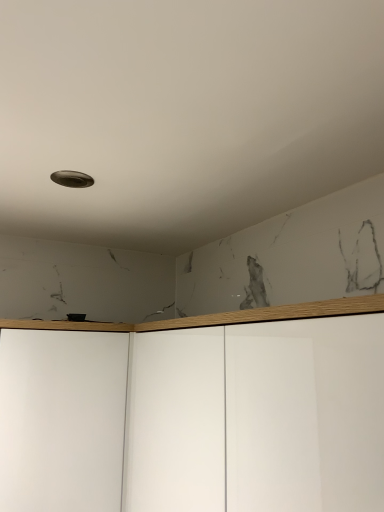
Where is `white glossy cabinet at lower left`? white glossy cabinet at lower left is located at coordinates (62, 420).

What do you see at coordinates (62, 420) in the screenshot? I see `white glossy cabinet at lower left` at bounding box center [62, 420].

What is the approximate height of white matte cabinet at center?

The height of white matte cabinet at center is 18.83 inches.

What do you see at coordinates (307, 414) in the screenshot?
I see `white matte cabinet at center` at bounding box center [307, 414].

At what (x,y) coordinates should I click in order to perform the action: click on white matte cabinet at center. Please return your answer as a coordinate pair (x, y). This screenshot has width=384, height=512. Looking at the image, I should click on (307, 414).

Locate an element on the screen. This screenshot has height=512, width=384. white glossy cabinet at lower left is located at coordinates (62, 420).

Is white matte cabinet at center at the left side of white glossy cabinet at lower left?

Incorrect, white matte cabinet at center is not on the left side of white glossy cabinet at lower left.

Is white matte cabinet at center further to camera compared to white glossy cabinet at lower left?

No, it is not.

Is point (159, 366) positioned after point (16, 367)?

No.

From the image's perspective, is white matte cabinet at center below white glossy cabinet at lower left?

No.

From a real-world perspective, between white matte cabinet at center and white glossy cabinet at lower left, who is vertically lower?

white glossy cabinet at lower left.

Which of these two, white matte cabinet at center or white glossy cabinet at lower left, is thinner?

With smaller width is white glossy cabinet at lower left.

Between white matte cabinet at center and white glossy cabinet at lower left, which one has more height?

white glossy cabinet at lower left.

Does white matte cabinet at center have a larger size compared to white glossy cabinet at lower left?

Yes, white matte cabinet at center is bigger than white glossy cabinet at lower left.

Is white matte cabinet at center inside or outside of white glossy cabinet at lower left?

white matte cabinet at center is outside white glossy cabinet at lower left.

Is white matte cabinet at center in contact with white glossy cabinet at lower left?

No, white matte cabinet at center is not in contact with white glossy cabinet at lower left.

Is white matte cabinet at center aimed at white glossy cabinet at lower left?

No, white matte cabinet at center is not facing towards white glossy cabinet at lower left.

Looking at this image, what's the angular difference between white matte cabinet at center and white glossy cabinet at lower left's facing directions?

90 degrees.

Identify the location of glass door below the white matte cabinet at center (from a real-world perspective). (62, 420).

Is white glossy cabinet at lower left at the right side of white matte cabinet at center?

Incorrect, white glossy cabinet at lower left is not on the right side of white matte cabinet at center.

Based on the photo, which object is further away from the camera taking this photo, white glossy cabinet at lower left or white matte cabinet at center?

white glossy cabinet at lower left.

Between point (92, 351) and point (292, 456), which one is positioned behind?

Point (92, 351)

From the image's perspective, is white glossy cabinet at lower left located beneath white matte cabinet at center?

Correct, white glossy cabinet at lower left appears lower than white matte cabinet at center in the image.

From a real-world perspective, which is physically below, white glossy cabinet at lower left or white matte cabinet at center?

In real-world perspective, white glossy cabinet at lower left is lower.

Which of these two, white glossy cabinet at lower left or white matte cabinet at center, is thinner?

With smaller width is white glossy cabinet at lower left.

Looking at this image, considering the relative sizes of white glossy cabinet at lower left and white matte cabinet at center in the image provided, is white glossy cabinet at lower left taller than white matte cabinet at center?

Yes, white glossy cabinet at lower left is taller than white matte cabinet at center.

Does white glossy cabinet at lower left have a larger size compared to white matte cabinet at center?

Incorrect, white glossy cabinet at lower left is not larger than white matte cabinet at center.

Can we say white glossy cabinet at lower left lies outside white matte cabinet at center?

That's correct, white glossy cabinet at lower left is outside of white matte cabinet at center.

Is white glossy cabinet at lower left not close to white matte cabinet at center?

They are positioned close to each other.

Looking at this image, does white glossy cabinet at lower left turn towards white matte cabinet at center?

No, white glossy cabinet at lower left is not oriented towards white matte cabinet at center.

Where is `glass door below the white matte cabinet at center (from a real-world perspective)`? glass door below the white matte cabinet at center (from a real-world perspective) is located at coordinates (62, 420).

At what (x,y) coordinates should I click in order to perform the action: click on dresser above the white glossy cabinet at lower left (from the image's perspective). Please return your answer as a coordinate pair (x, y). The height and width of the screenshot is (512, 384). Looking at the image, I should click on (307, 414).

The image size is (384, 512). I want to click on dresser to the right of white glossy cabinet at lower left, so click(x=307, y=414).